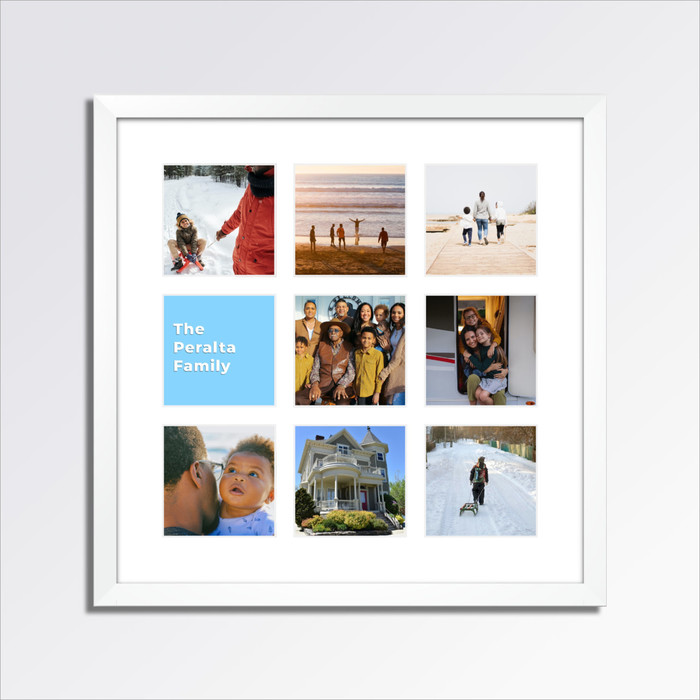
This screenshot has height=700, width=700. Identify the location of boxes. (483, 470), (330, 490), (227, 500), (231, 348), (337, 348), (486, 337), (496, 230), (339, 246), (241, 250).